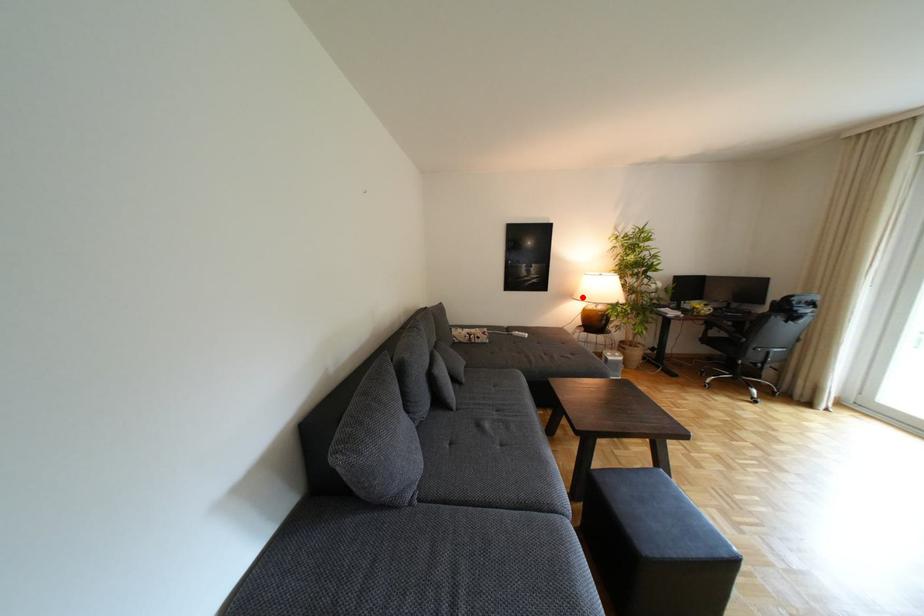
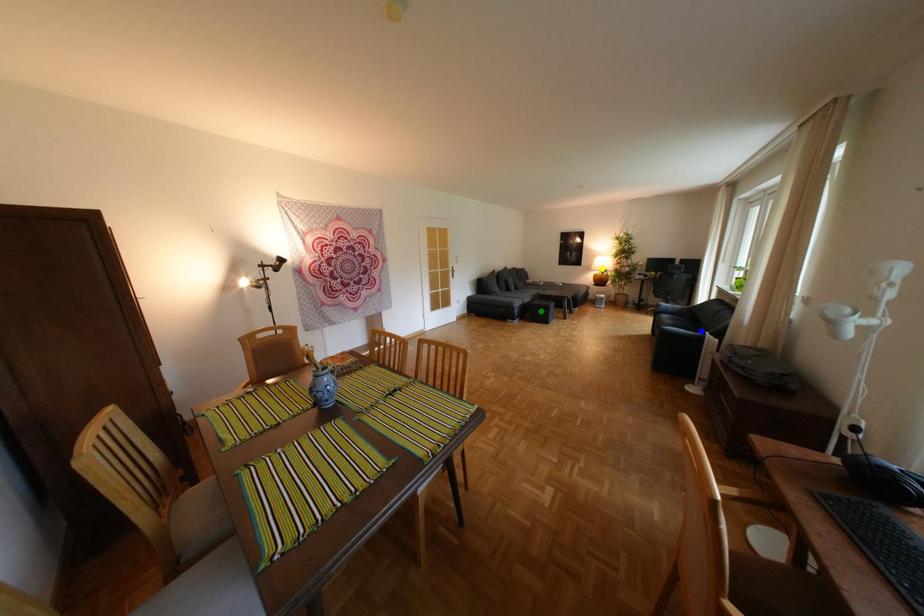
Question: I am providing you with two images of the same scene from different viewpoints. A red point is marked on the first image. You are given multiple points on the second image. In image 2, which mark is for the same physical point as the one in image 1?

Choices:
 (A) yellow point
 (B) blue point
 (C) green point

Answer: (A)